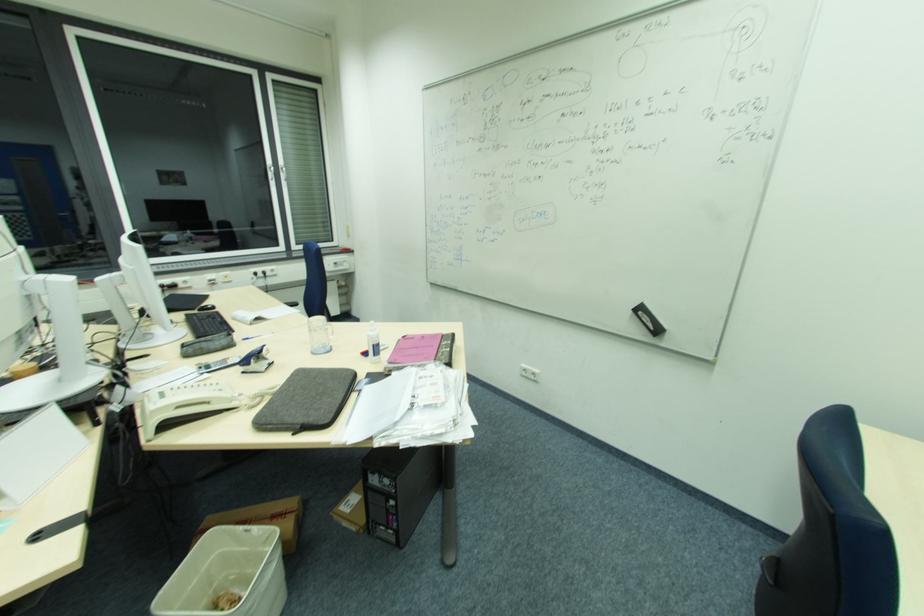
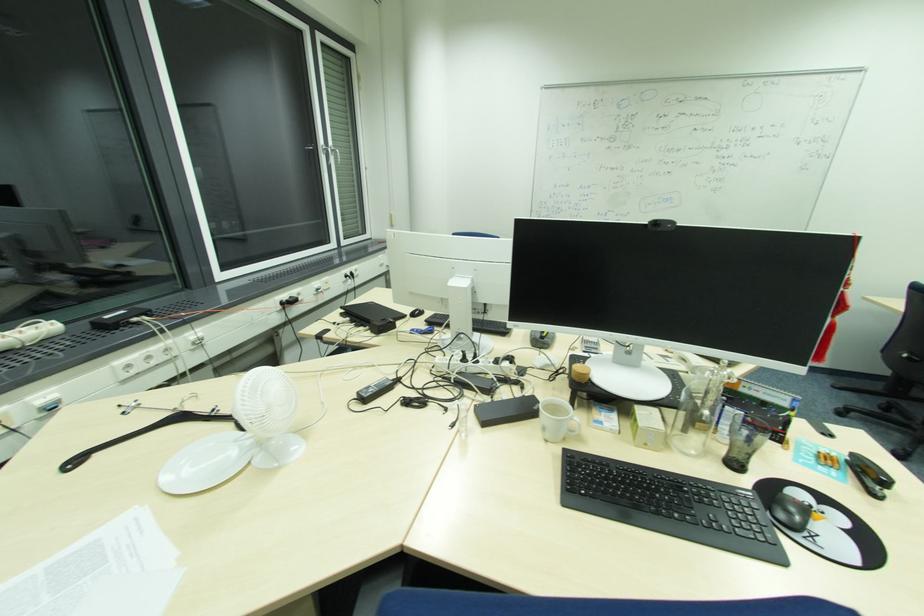
Question: The images are taken continuously from a first-person perspective. In which direction are you moving?

Choices:
 (A) Left
 (B) Right
 (C) Forward
 (D) Backward

Answer: (A)